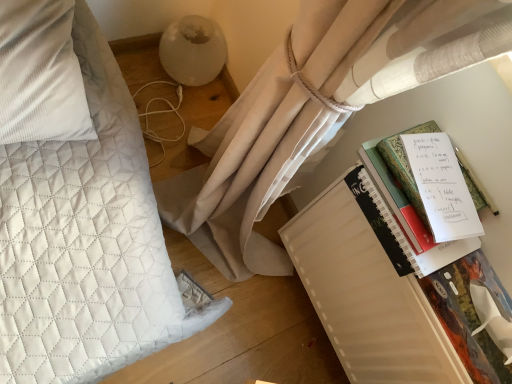
Question: Should I look upward or downward to see white matte notebook at right, which is the first paperback book from back to front?

Choices:
 (A) up
 (B) down

Answer: (B)

Question: Is white matte notebook at right, positioned as the second paperback book in front-to-back order, positioned far away from hardcover book at right, the first paperback book from the front?

Choices:
 (A) yes
 (B) no

Answer: (B)

Question: Is white matte notebook at right, which is the first paperback book from back to front, behind hardcover book at right, which is the second paperback book from back to front?

Choices:
 (A) no
 (B) yes

Answer: (B)

Question: Considering the relative sizes of white matte notebook at right, which is the first paperback book from back to front, and hardcover book at right, the first paperback book from the front, in the image provided, is white matte notebook at right, which is the first paperback book from back to front, wider than hardcover book at right, the first paperback book from the front,?

Choices:
 (A) yes
 (B) no

Answer: (A)

Question: Can you confirm if white matte notebook at right, positioned as the second paperback book in front-to-back order, is positioned to the right of hardcover book at right, the first paperback book from the front?

Choices:
 (A) no
 (B) yes

Answer: (A)

Question: Is white matte notebook at right, positioned as the second paperback book in front-to-back order, positioned with its back to hardcover book at right, the first paperback book from the front?

Choices:
 (A) yes
 (B) no

Answer: (B)

Question: Can you confirm if white matte notebook at right, which is the first paperback book from back to front, is shorter than hardcover book at right, the first paperback book from the front?

Choices:
 (A) yes
 (B) no

Answer: (B)

Question: Is hardcover book at right, which is the second paperback book from back to front, facing towards white paper notebook at right?

Choices:
 (A) no
 (B) yes

Answer: (A)

Question: Considering the relative sizes of hardcover book at right, which is the second paperback book from back to front, and white paper notebook at right in the image provided, is hardcover book at right, which is the second paperback book from back to front, shorter than white paper notebook at right?

Choices:
 (A) yes
 (B) no

Answer: (A)

Question: Is hardcover book at right, the first paperback book from the front, not close to white paper notebook at right?

Choices:
 (A) yes
 (B) no

Answer: (B)

Question: Would you say white paper notebook at right is part of hardcover book at right, the first paperback book from the front,'s contents?

Choices:
 (A) yes
 (B) no

Answer: (B)

Question: Is hardcover book at right, which is the second paperback book from back to front, wider than white paper notebook at right?

Choices:
 (A) no
 (B) yes

Answer: (A)

Question: Is hardcover book at right, the first paperback book from the front, placed right next to white paper notebook at right?

Choices:
 (A) no
 (B) yes

Answer: (A)

Question: Is hardcover book at right, which is the second paperback book from back to front, thinner than white quilted pillow at left?

Choices:
 (A) yes
 (B) no

Answer: (A)